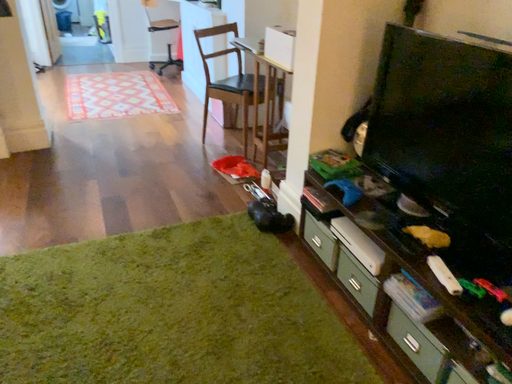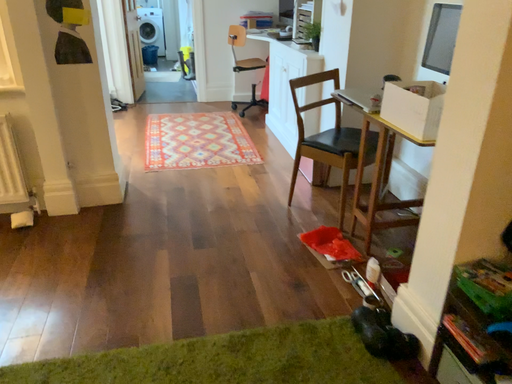
Question: Which way did the camera rotate in the video?

Choices:
 (A) rotated left
 (B) rotated right

Answer: (A)